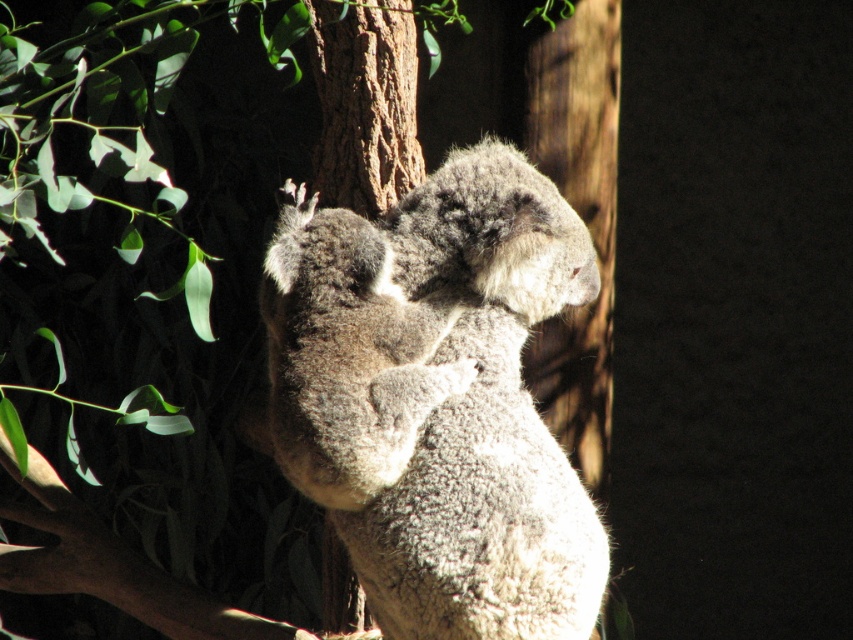
You are a wildlife photographer aiming to capture a closeup of the fuzzy gray koala at center and the brown textured tree trunk at center. Given that your camera can only focus on one object at a time, which object should you focus on to ensure the larger subject is in sharp detail?

The fuzzy gray koala at center is larger in size than the brown textured tree trunk at center, so you should focus on the fuzzy gray koala at center to ensure the larger subject is in sharp detail.

You are a photographer trying to capture a closeup of the fuzzy gray koala at center. You notice the brown textured tree trunk at center is also in the frame. Which object is nearer to your camera lens?

The fuzzy gray koala at center is closer to the viewer than the brown textured tree trunk at center, so the koala would be nearer to the camera lens.